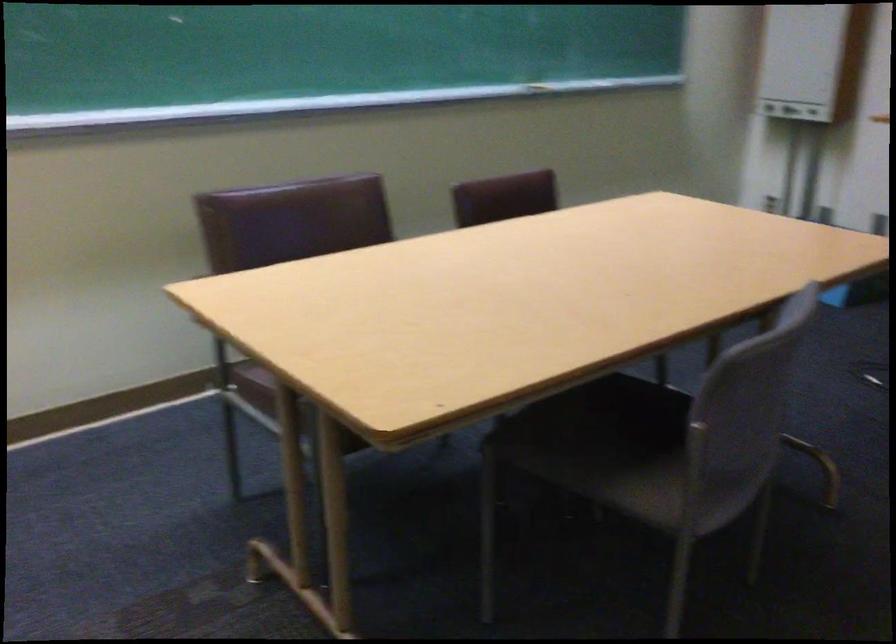
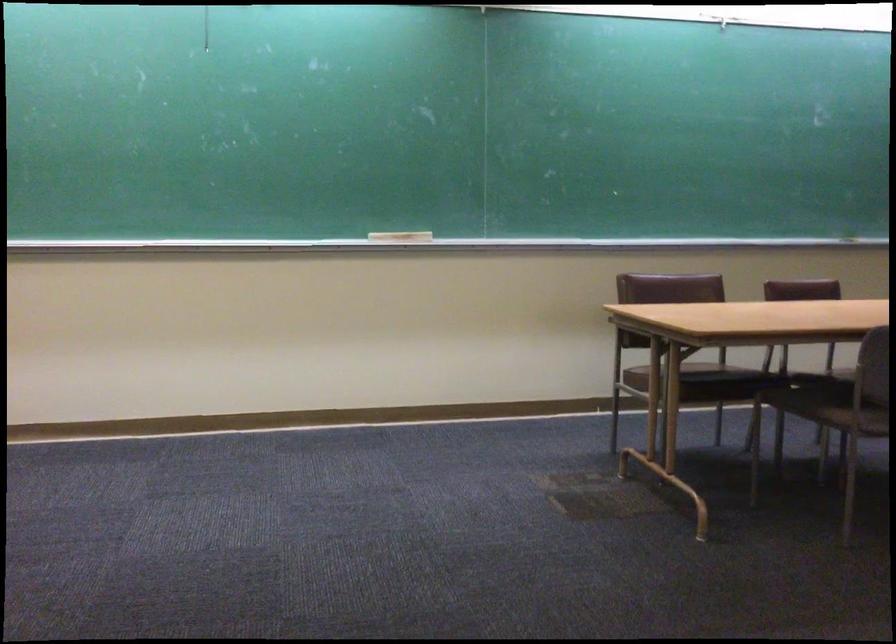
Question: In a continuous first-person perspective shot, in which direction is the camera moving?

Choices:
 (A) Left
 (B) Right
 (C) Forward
 (D) Backward

Answer: (D)